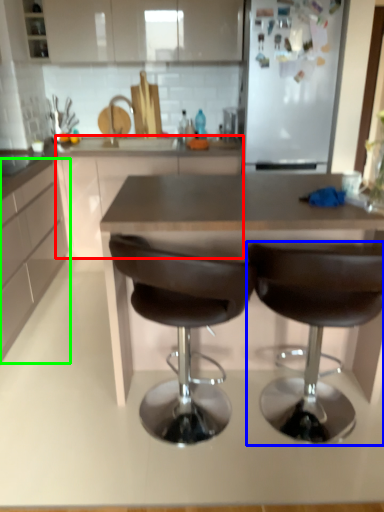
Question: Which is farther away from counter (highlighted by a red box)? chair (highlighted by a blue box) or cabinetry (highlighted by a green box)?

Choices:
 (A) chair
 (B) cabinetry

Answer: (A)